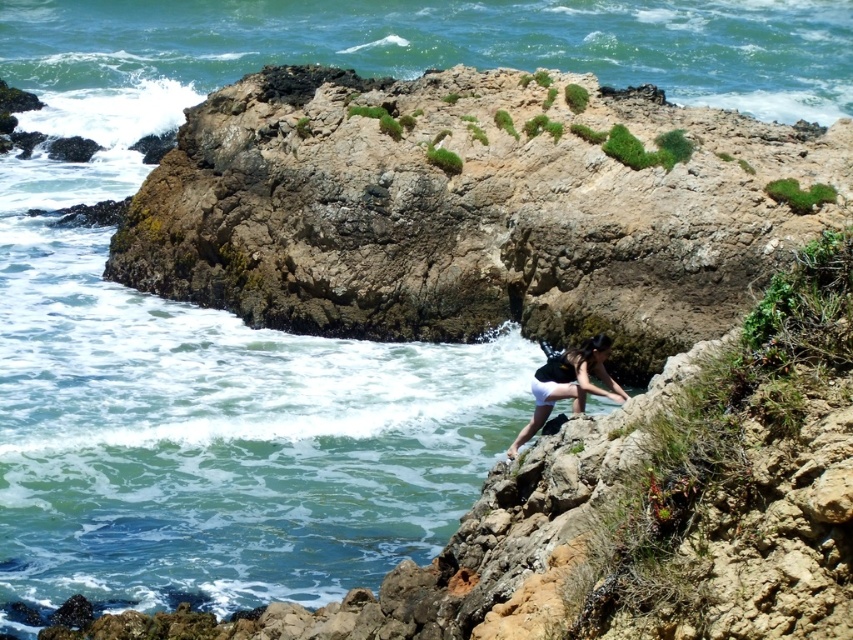
Question: Observing the image, what is the correct spatial positioning of white matte shorts at lower center in reference to white matte bikini top at lower center?

Choices:
 (A) below
 (B) above

Answer: (B)

Question: Which point is closer to the camera taking this photo?

Choices:
 (A) (535, 403)
 (B) (538, 420)

Answer: (B)

Question: Among these objects, which one is nearest to the camera?

Choices:
 (A) white matte shorts at lower center
 (B) white matte bikini top at lower center

Answer: (A)

Question: Is white matte shorts at lower center to the right of white matte bikini top at lower center from the viewer's perspective?

Choices:
 (A) yes
 (B) no

Answer: (A)

Question: Where is white matte shorts at lower center located in relation to white matte bikini top at lower center in the image?

Choices:
 (A) left
 (B) right

Answer: (B)